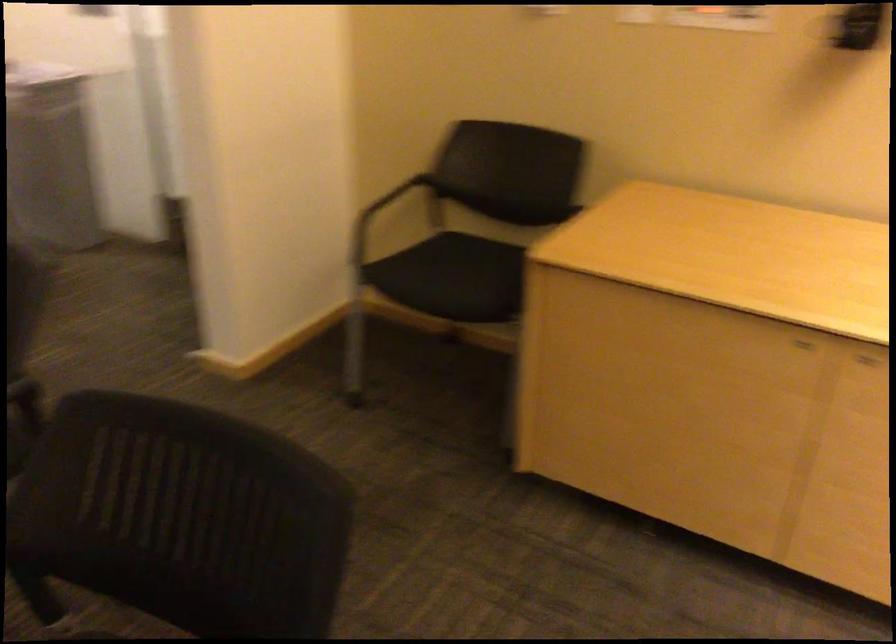
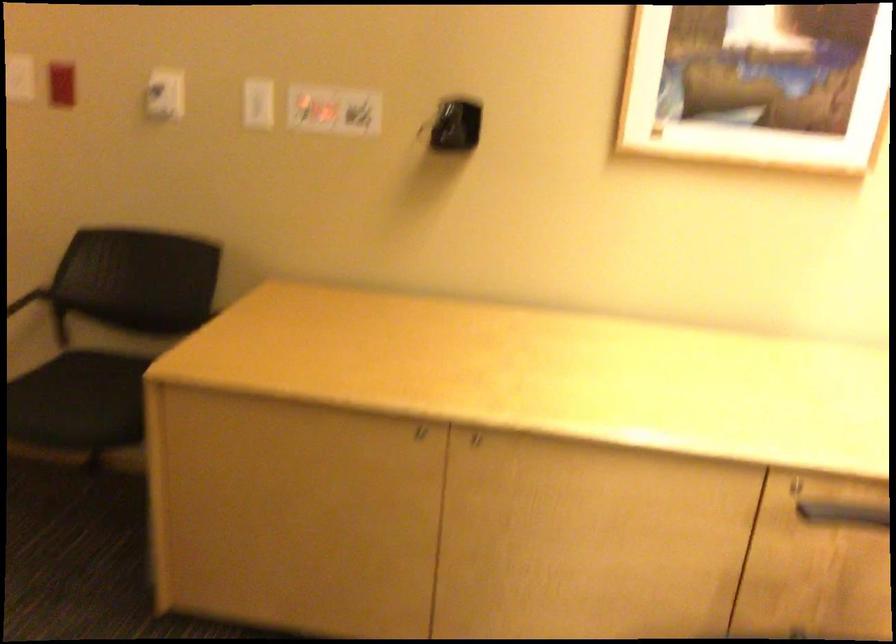
Question: The images are taken continuously from a first-person perspective. In which direction are you moving?

Choices:
 (A) Left
 (B) Right
 (C) Forward
 (D) Backward

Answer: (B)